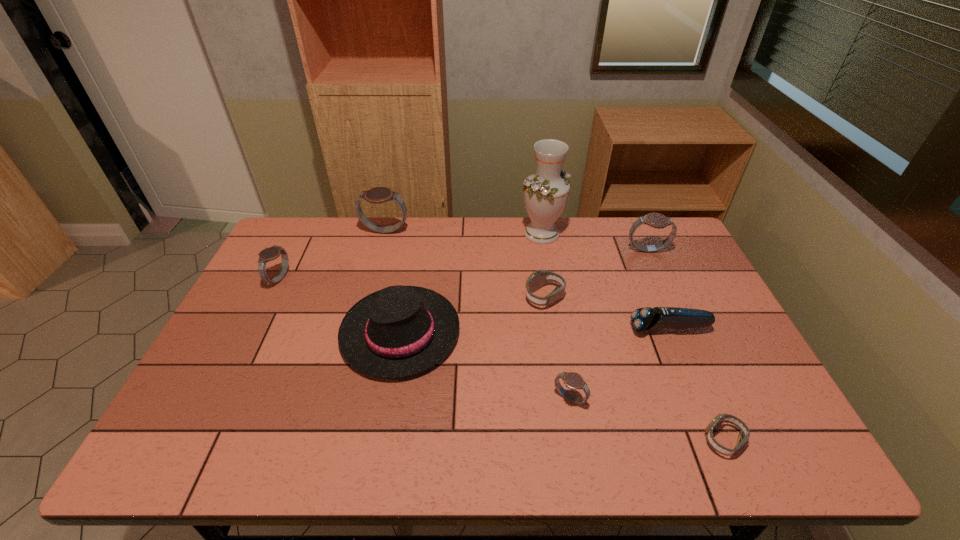
Locate an element on the screen. This screenshot has width=960, height=540. vacant space located on the face of the bigger white watch is located at coordinates (440, 297).

In order to click on blank area located 0.330m on the face of the bigger white watch in this screenshot , I will do `click(417, 297)`.

You are a GUI agent. You are given a task and a screenshot of the screen. Output one action in this format:
    pyautogui.click(x=<x>, y=<y>)
    Task: Click on the vacant space situated 0.300m on the face of the bigger white watch
    This screenshot has width=960, height=540.
    Given the screenshot: What is the action you would take?
    pyautogui.click(x=426, y=297)

Identify the location of vacant space located on the head of the electric shaver. The height and width of the screenshot is (540, 960). (612, 329).

What are the coordinates of `free location located 0.380m on the head of the electric shaver` in the screenshot? It's located at (495, 329).

The height and width of the screenshot is (540, 960). I want to click on free space located on the head of the electric shaver, so click(498, 329).

The height and width of the screenshot is (540, 960). Find the location of `free space located 0.360m on the right of the nearest gray watch`. free space located 0.360m on the right of the nearest gray watch is located at coordinates (733, 399).

Identify the location of free region located 0.150m on the face of the nearest object. (637, 440).

Locate an element on the screen. Image resolution: width=960 pixels, height=540 pixels. free space located on the face of the nearest object is located at coordinates (651, 440).

At what (x,y) coordinates should I click in order to perform the action: click on vacant space located 0.350m on the face of the nearest object. Please return your answer as a coordinate pair (x, y). This screenshot has width=960, height=540. Looking at the image, I should click on (549, 440).